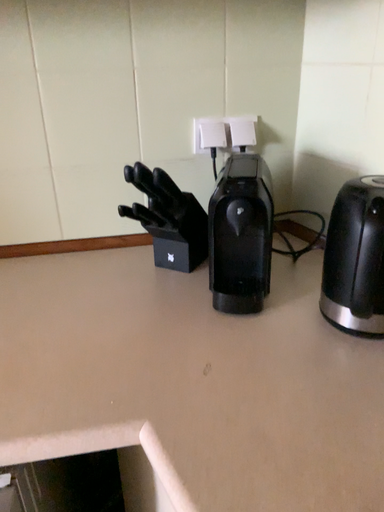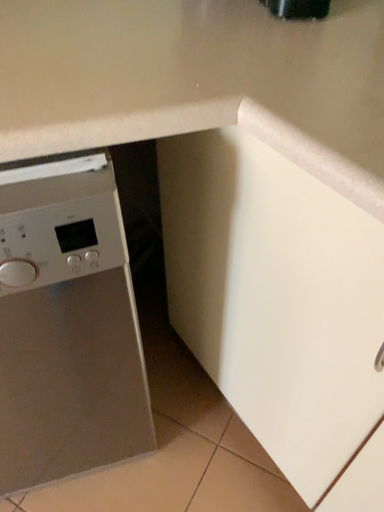
Question: How did the camera likely rotate when shooting the video?

Choices:
 (A) rotated downward
 (B) rotated upward

Answer: (A)